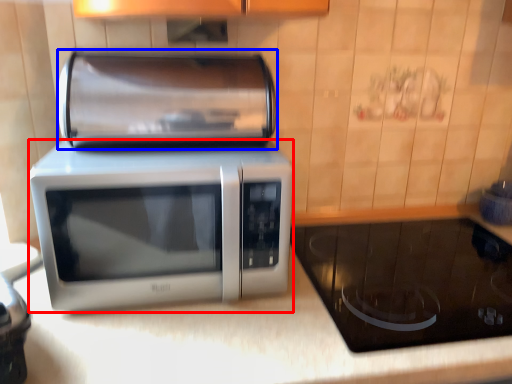
Question: Which of the following is the closest to the observer, microwave oven (highlighted by a red box) or appliance (highlighted by a blue box)?

Choices:
 (A) microwave oven
 (B) appliance

Answer: (A)